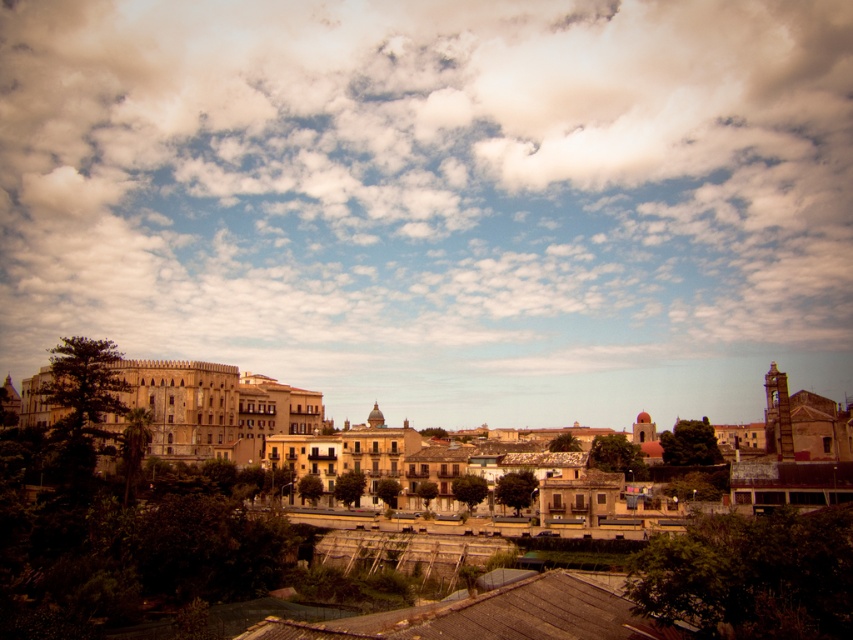
Between cloudy sky at upper center and brown stone buildings at left, which one is positioned lower?

brown stone buildings at left

Can you confirm if cloudy sky at upper center is shorter than brown stone buildings at left?

No, cloudy sky at upper center is not shorter than brown stone buildings at left.

Who is more distant from viewer, (x=59, y=234) or (x=247, y=394)?

Positioned behind is point (x=59, y=234).

The image size is (853, 640). In order to click on cloudy sky at upper center in this screenshot , I will do `click(425, 180)`.